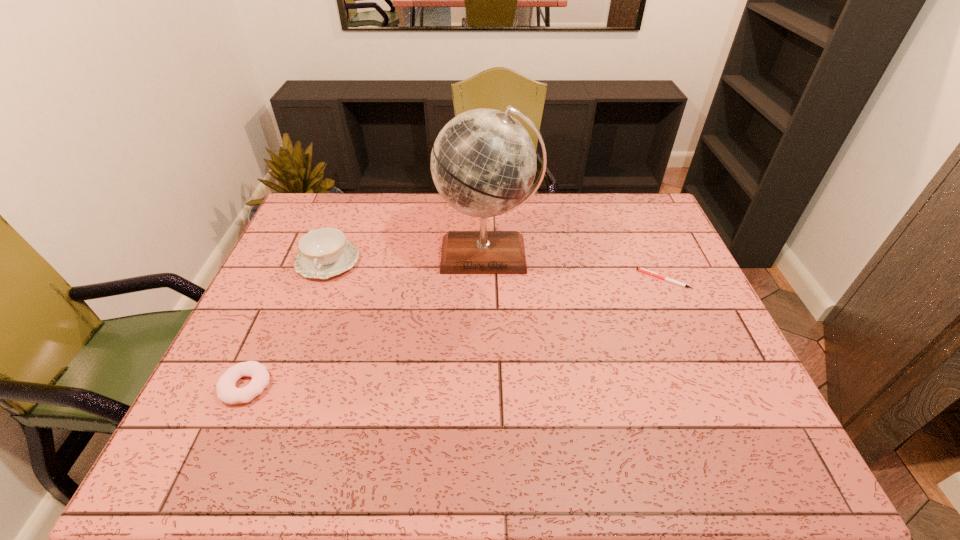
In order to click on object that is the second closest to the third object from left to right in this screenshot , I will do `click(639, 269)`.

Choose which object is the nearest neighbor to the tallest object. Please provide its 2D coordinates. Your answer should be formatted as a tuple, i.e. [(x, y)], where the tuple contains the x and y coordinates of a point satisfying the conditions above.

[(324, 252)]

This screenshot has width=960, height=540. I want to click on free location that satisfies the following two spatial constraints: 1. on the clicker of the shortest object; 2. on the front side of the second shortest object, so click(x=711, y=386).